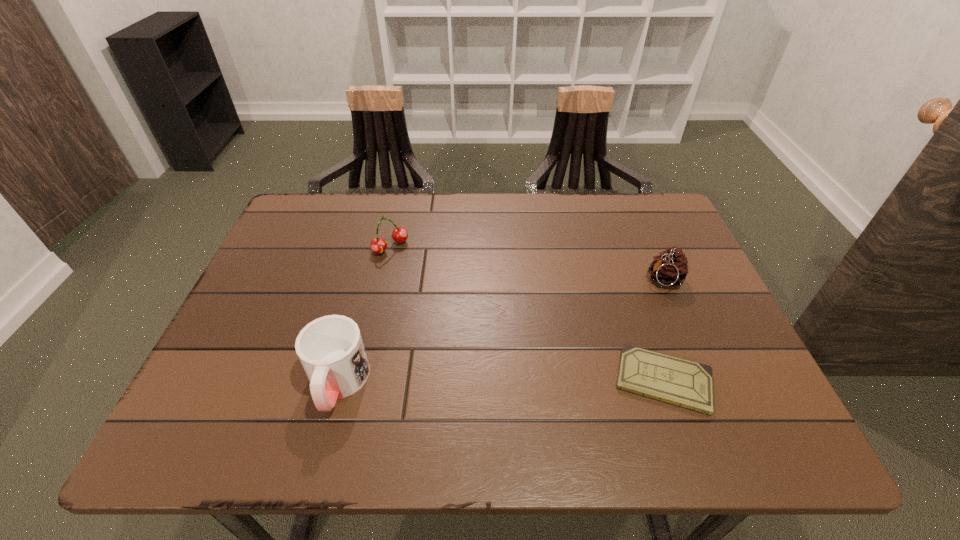
What are the coordinates of `mug` in the screenshot? It's located at (330, 349).

Find the location of a particular element. This screenshot has width=960, height=540. checkbook is located at coordinates (681, 382).

This screenshot has height=540, width=960. Find the location of `pinecone`. pinecone is located at coordinates (670, 268).

You are a GUI agent. You are given a task and a screenshot of the screen. Output one action in this format:
    pyautogui.click(x=<x>, y=<y>)
    Task: Click on the cherry
    The image size is (960, 540).
    Given the screenshot: What is the action you would take?
    pyautogui.click(x=378, y=245)

This screenshot has width=960, height=540. I want to click on free spot located 0.280m on the left of the shortest object, so click(478, 380).

The height and width of the screenshot is (540, 960). In order to click on free space located with a leaf charm attached to the third nearest object in this screenshot , I will do `click(611, 310)`.

Find the location of a particular element. free region located with a leaf charm attached to the third nearest object is located at coordinates (619, 305).

This screenshot has height=540, width=960. Find the location of `free spot located with a leaf charm attached to the third nearest object`. free spot located with a leaf charm attached to the third nearest object is located at coordinates (554, 340).

This screenshot has height=540, width=960. What are the coordinates of `vacant space located 0.060m with stems pointing upwards on the farthest object` in the screenshot? It's located at (413, 267).

You are a GUI agent. You are given a task and a screenshot of the screen. Output one action in this format:
    pyautogui.click(x=<x>, y=<y>)
    Task: Click on the free space located with stems pointing upwards on the farthest object
    
    Given the screenshot: What is the action you would take?
    pyautogui.click(x=498, y=347)